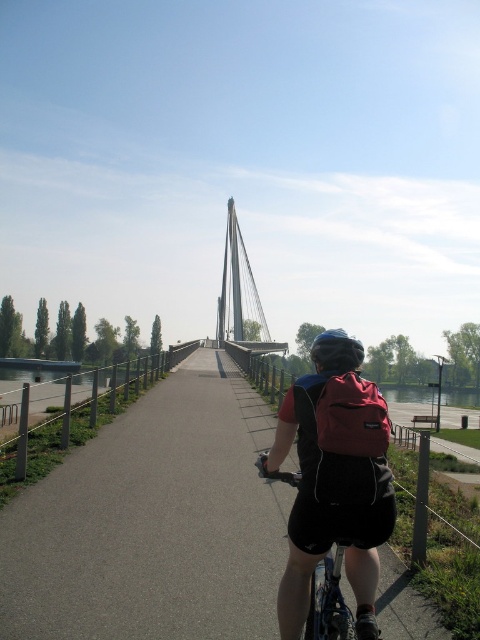
Question: Among these objects, which one is nearest to the camera?

Choices:
 (A) red fabric backpack at center
 (B) matte black helmet at center
 (C) black asphalt path at center
 (D) silver metallic suspension bridge at center

Answer: (A)

Question: Is matte black backpack at center to the right of silver metallic suspension bridge at center from the viewer's perspective?

Choices:
 (A) yes
 (B) no

Answer: (A)

Question: Is red fabric backpack at center positioned at the back of matte black helmet at center?

Choices:
 (A) yes
 (B) no

Answer: (B)

Question: Among these objects, which one is farthest from the camera?

Choices:
 (A) matte black backpack at center
 (B) silver metallic suspension bridge at center

Answer: (B)

Question: Which point is farther to the camera?

Choices:
 (A) (369, 497)
 (B) (145, 522)
 (C) (358, 548)
 (D) (236, 310)

Answer: (D)

Question: Can you confirm if black asphalt path at center is smaller than silver metallic suspension bridge at center?

Choices:
 (A) no
 (B) yes

Answer: (B)